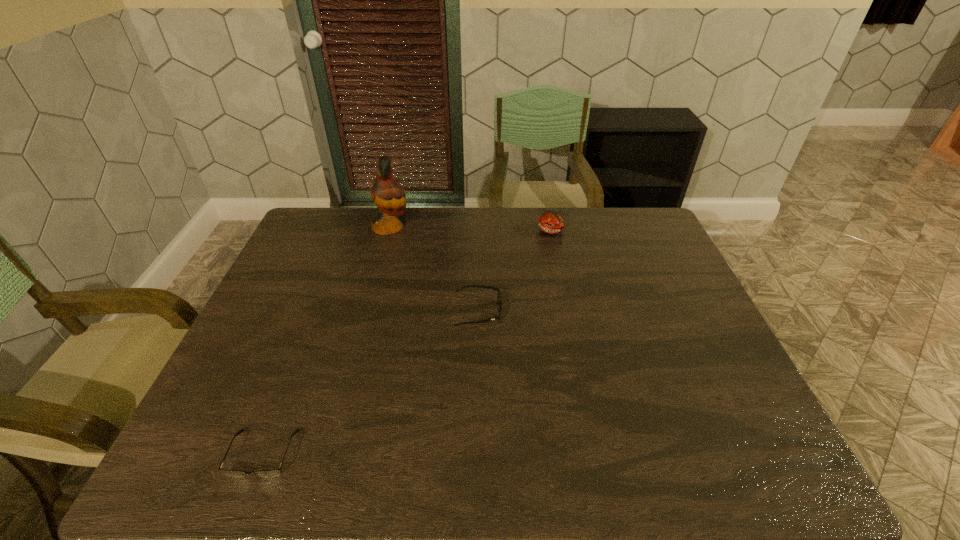
The image size is (960, 540). What are the coordinates of `the tallest object` in the screenshot? It's located at (387, 194).

This screenshot has height=540, width=960. I want to click on the second object from left to right, so click(387, 194).

This screenshot has height=540, width=960. What are the coordinates of `the rightmost object` in the screenshot? It's located at (551, 222).

This screenshot has height=540, width=960. In order to click on tomato in this screenshot , I will do tap(551, 222).

Identify the location of the third tallest object. (499, 298).

This screenshot has height=540, width=960. Find the location of `the second object from right to left`. the second object from right to left is located at coordinates (499, 298).

Locate an element on the screen. the shortest object is located at coordinates (275, 472).

Where is `spectacles`? This screenshot has width=960, height=540. spectacles is located at coordinates (275, 472).

Find the location of a particular element. Image resolution: width=960 pixels, height=540 pixels. free spot located on the face of the parrot is located at coordinates (452, 227).

Identify the location of free space located on the left of the tomato. Image resolution: width=960 pixels, height=540 pixels. (479, 231).